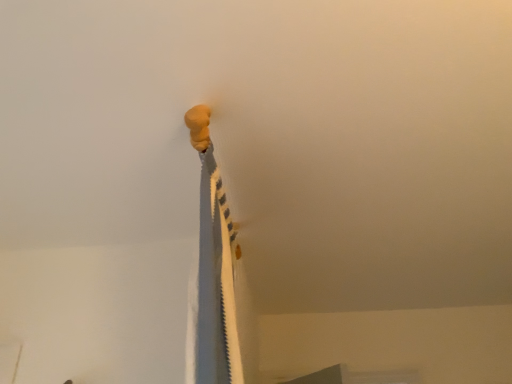
The image size is (512, 384). Describe the element at coordinates (214, 268) in the screenshot. I see `matte yellow rocket at upper center` at that location.

At what (x,y) coordinates should I click in order to perform the action: click on matte yellow rocket at upper center. Please return your answer as a coordinate pair (x, y). The width and height of the screenshot is (512, 384). Looking at the image, I should click on (214, 268).

What are the coordinates of `matte yellow rocket at upper center` in the screenshot? It's located at (214, 268).